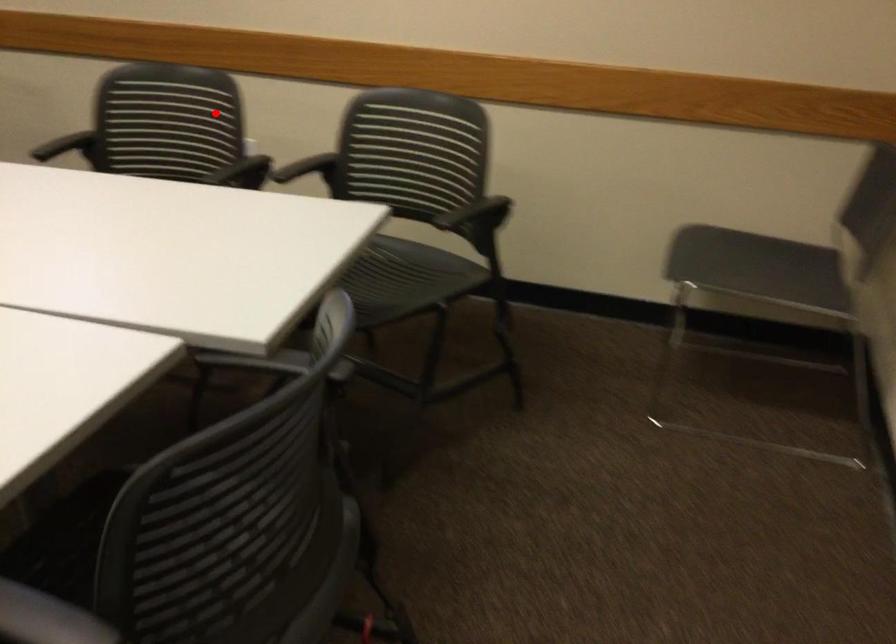
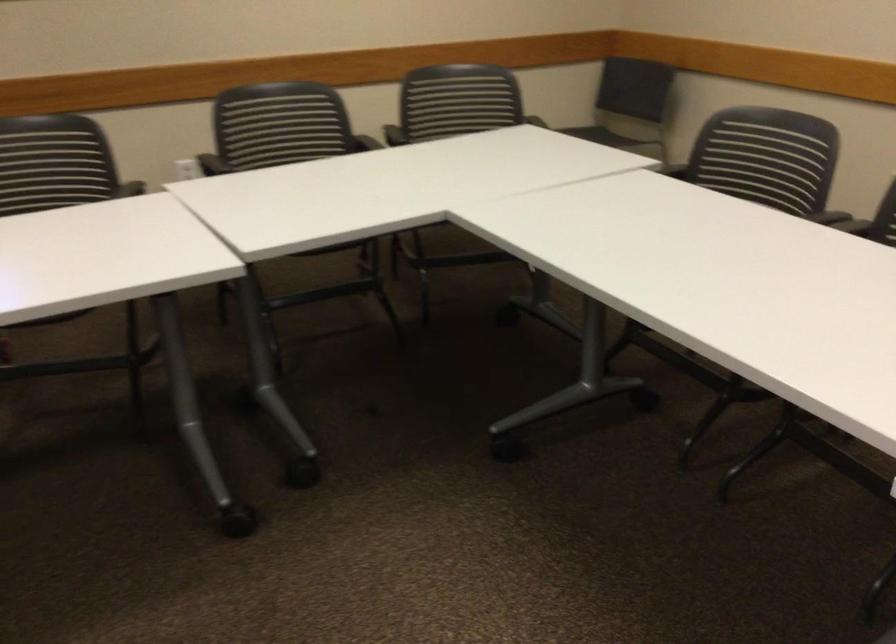
Question: I am providing you with two images of the same scene from different viewpoints. A red point is marked on the first image. Is the red point's position out of view in image 2?

Choices:
 (A) Yes
 (B) No

Answer: (B)